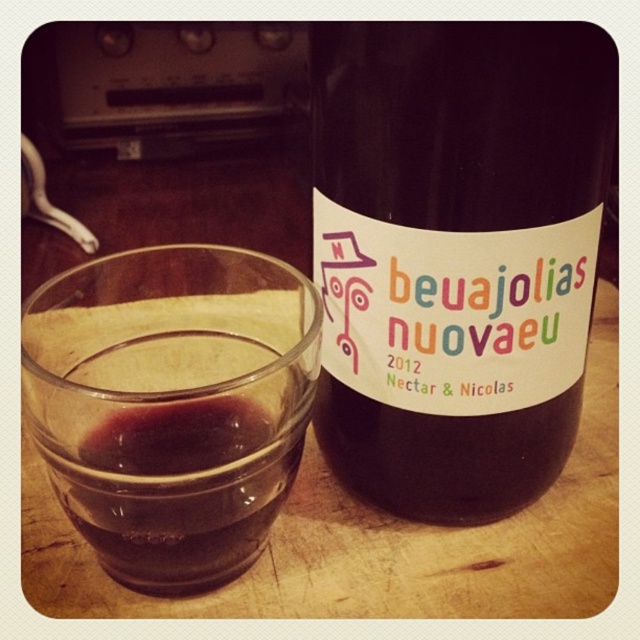
Question: Which of the following is the closest to the observer?

Choices:
 (A) dark red glass at center
 (B) dark glass bottle at center

Answer: (A)

Question: Which object appears farthest from the camera in this image?

Choices:
 (A) dark glass bottle at center
 (B) dark red glass at center

Answer: (A)

Question: Which object is closer to the camera taking this photo?

Choices:
 (A) dark red glass at center
 (B) dark glass bottle at center

Answer: (A)

Question: Where is dark glass bottle at center located in relation to dark red glass at center in the image?

Choices:
 (A) left
 (B) right

Answer: (B)

Question: Can you confirm if dark glass bottle at center is bigger than dark red glass at center?

Choices:
 (A) no
 (B) yes

Answer: (B)

Question: Can you confirm if dark glass bottle at center is positioned to the right of dark red glass at center?

Choices:
 (A) yes
 (B) no

Answer: (A)